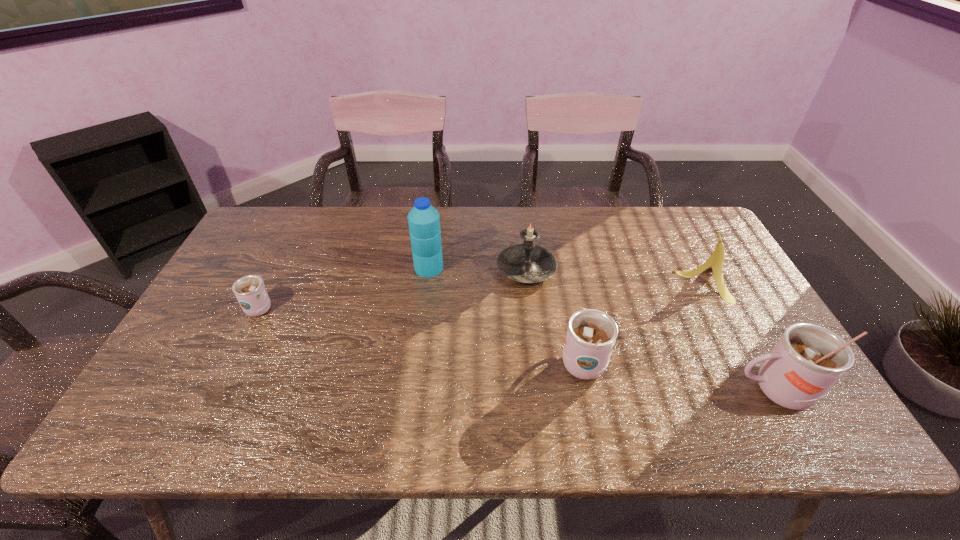
If the aim is uniform spacing by inserting an additional cup among them, please point to a vacant space for this new cup. Please provide its 2D coordinates. Your answer should be formatted as a tuple, i.e. [(x, y)], where the tuple contains the x and y coordinates of a point satisfying the conditions above.

[(412, 331)]